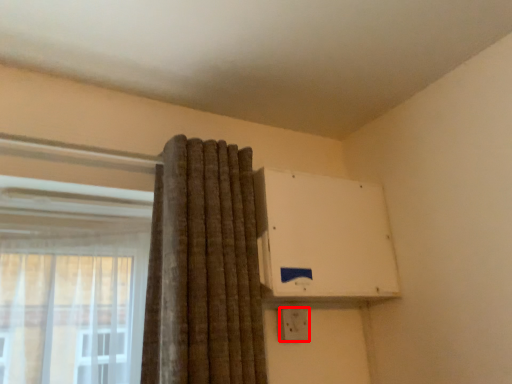
Question: From the image, what is the correct spatial relationship of electric outlet (annotated by the red box) in relation to air conditioning?

Choices:
 (A) right
 (B) left

Answer: (B)